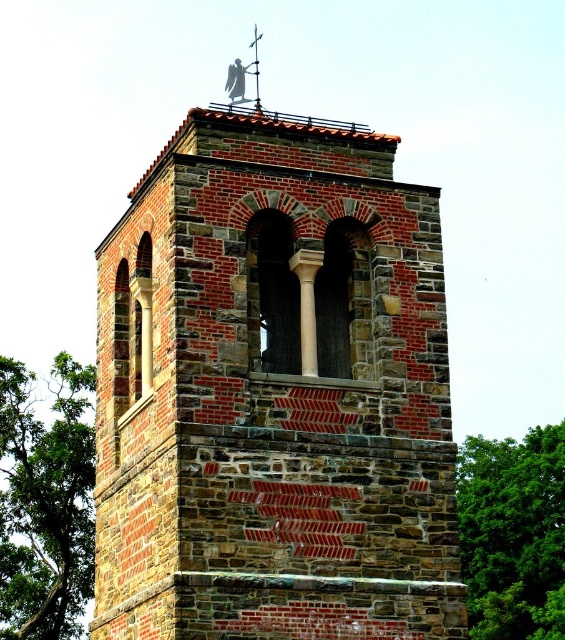
Question: Does brick tower at center have a lesser width compared to green leafy tree at lower left?

Choices:
 (A) yes
 (B) no

Answer: (B)

Question: Among these points, which one is farthest from the camera?

Choices:
 (A) (1, 628)
 (B) (368, 321)

Answer: (A)

Question: Which of these objects is positioned closest to the brick tower at center?

Choices:
 (A) green leafy tree at lower left
 (B) green leafy tree at right

Answer: (A)

Question: In this image, where is brick tower at center located relative to green leafy tree at lower left?

Choices:
 (A) right
 (B) left

Answer: (A)

Question: Among these objects, which one is nearest to the camera?

Choices:
 (A) green leafy tree at right
 (B) green leafy tree at lower left
 (C) brick tower at center

Answer: (C)

Question: Is brick tower at center above green leafy tree at right?

Choices:
 (A) yes
 (B) no

Answer: (A)